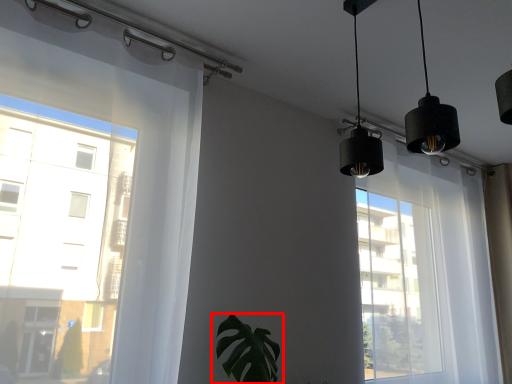
Question: From the image's perspective, what is the correct spatial relationship of houseplant (annotated by the red box) in relation to bay window?

Choices:
 (A) above
 (B) below

Answer: (B)